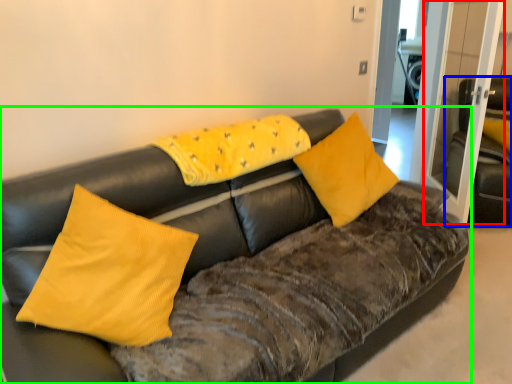
Question: Which object is the farthest from glass door (highlighted by a red box)? Choose among these: armchair (highlighted by a blue box) or studio couch (highlighted by a green box).

Choices:
 (A) armchair
 (B) studio couch

Answer: (B)